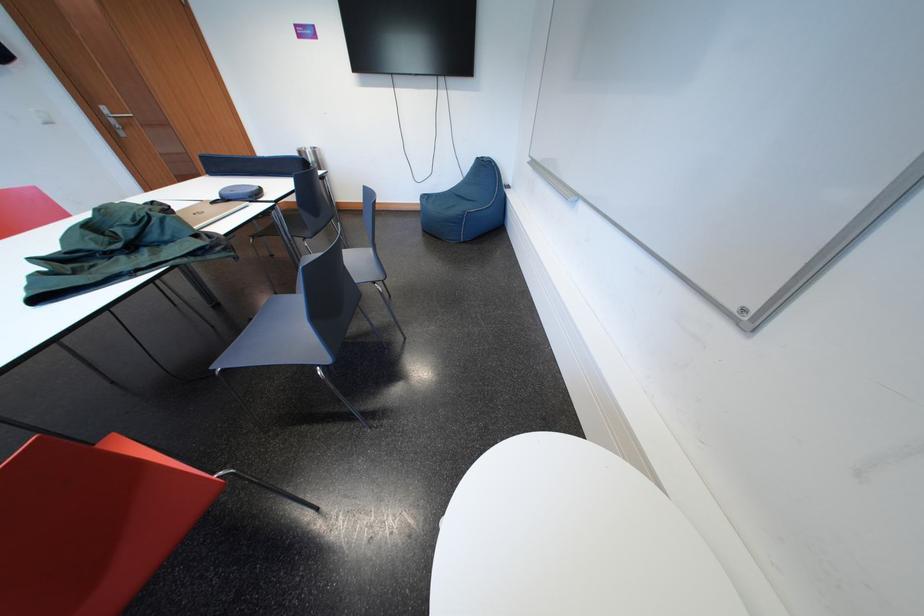
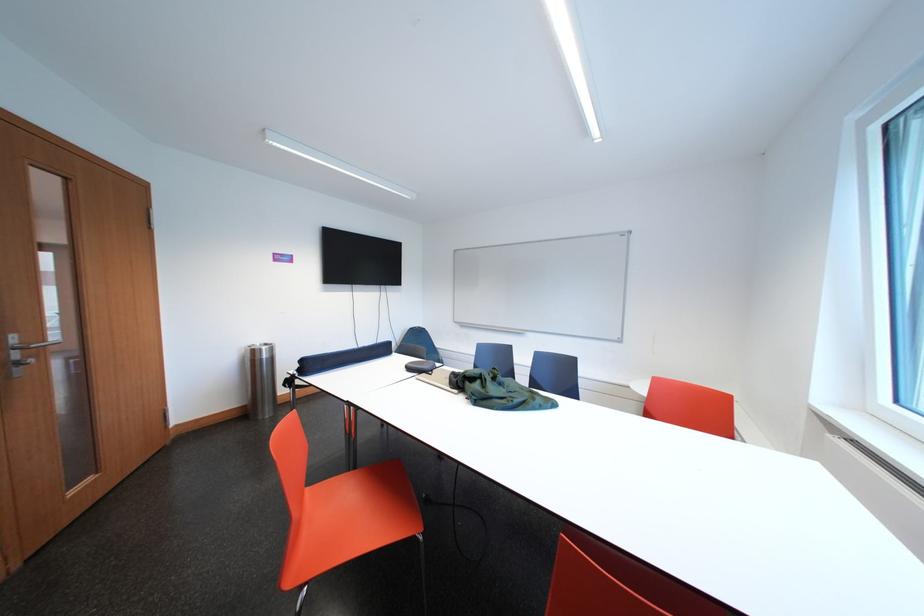
Question: I am providing you with two images of the same scene from different viewpoints. Please identify which objects are invisible in image2.

Choices:
 (A) grey chair sitting surface
 (B) dispenser slider
 (C) metal door handle
 (D) black rectangular case

Answer: (A)